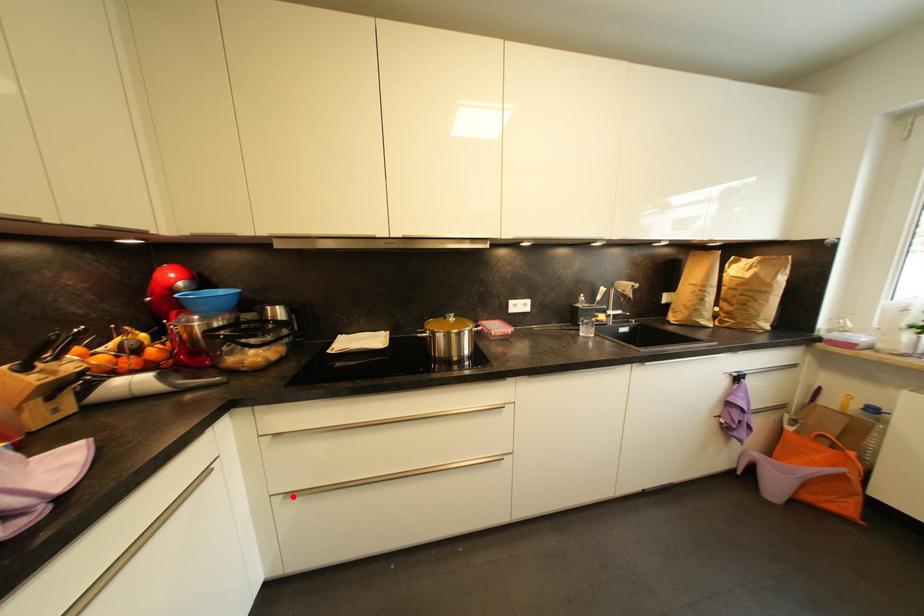
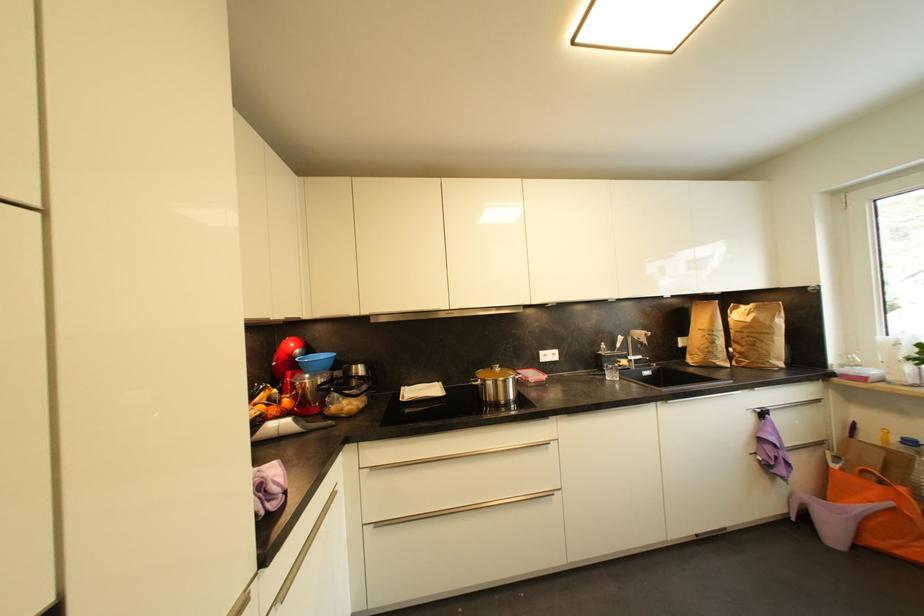
Question: I am providing you with two images of the same scene from different viewpoints. Given a red point in image1, look at the same physical point in image2. Is it:

Choices:
 (A) Closer to the viewpoint
 (B) Farther from the viewpoint

Answer: (B)